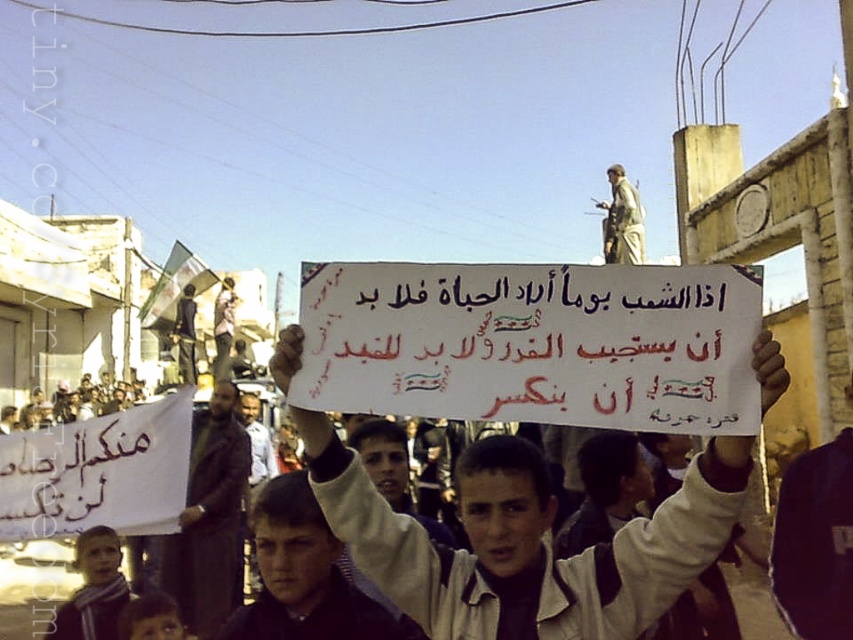
You are a photographer trying to capture the protest scene. You notice the white paper placard at center and the dark brown leather jacket at lower left. Which object should you focus on first if you want to photograph the taller object?

The dark brown leather jacket at lower left is taller than the white paper placard at center, so you should focus on the dark brown leather jacket at lower left first.

What are the coordinates of the white paper placard at center?

The white paper placard at center is located at point (532,342).

You are a photographer trying to capture the protest scene. You notice two points in the image at coordinates point (312, 340) and point (222, 472). Which point should you focus on to ensure it appears larger in your photo?

Point (312, 340) is closer to the camera than point (222, 472), so focusing on point (312, 340) will make it appear larger in the photo.